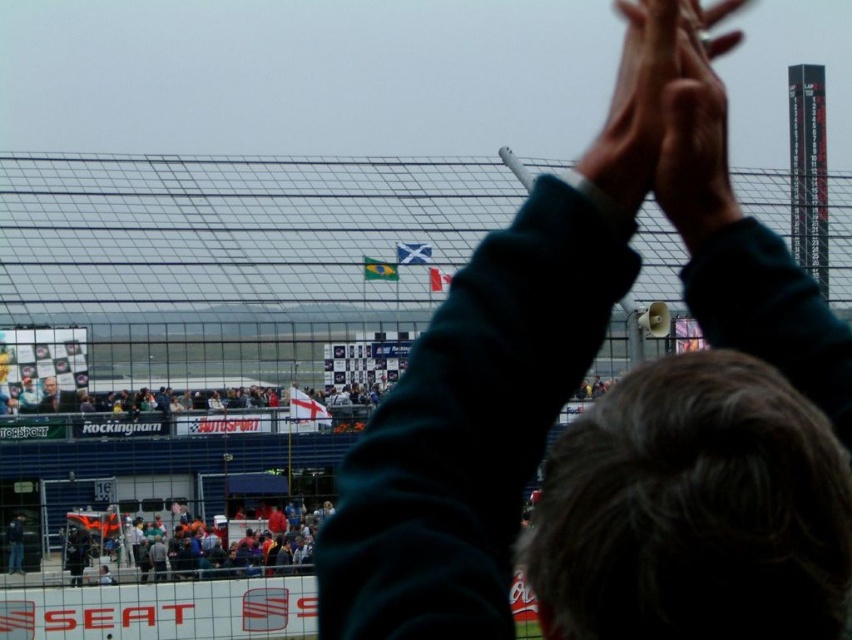
Who is more distant from viewer, (475,596) or (164,561)?

The point (164,561) is more distant.

Does dark green sweater at upper center have a smaller size compared to multicolored fabric crowd at lower center?

No, dark green sweater at upper center is not smaller than multicolored fabric crowd at lower center.

The image size is (852, 640). Describe the element at coordinates (611, 408) in the screenshot. I see `dark green sweater at upper center` at that location.

You are a GUI agent. You are given a task and a screenshot of the screen. Output one action in this format:
    pyautogui.click(x=<x>, y=<y>)
    Task: Click on the dark green sweater at upper center
    This screenshot has width=852, height=640.
    Given the screenshot: What is the action you would take?
    pyautogui.click(x=611, y=408)

From the picture: Which is more to the left, dark green sweater at upper center or smooth skin hands at upper center?

From the viewer's perspective, dark green sweater at upper center appears more on the left side.

Does dark green sweater at upper center have a greater width compared to smooth skin hands at upper center?

Yes.

Which is behind, point (515, 449) or point (703, 26)?

Positioned behind is point (703, 26).

Where is `dark green sweater at upper center`? dark green sweater at upper center is located at coordinates (611, 408).

Between dark green sweater at upper center and smooth skin face at upper left, which one appears on the right side from the viewer's perspective?

Positioned to the right is dark green sweater at upper center.

This screenshot has width=852, height=640. Describe the element at coordinates (611, 408) in the screenshot. I see `dark green sweater at upper center` at that location.

This screenshot has width=852, height=640. I want to click on dark green sweater at upper center, so click(x=611, y=408).